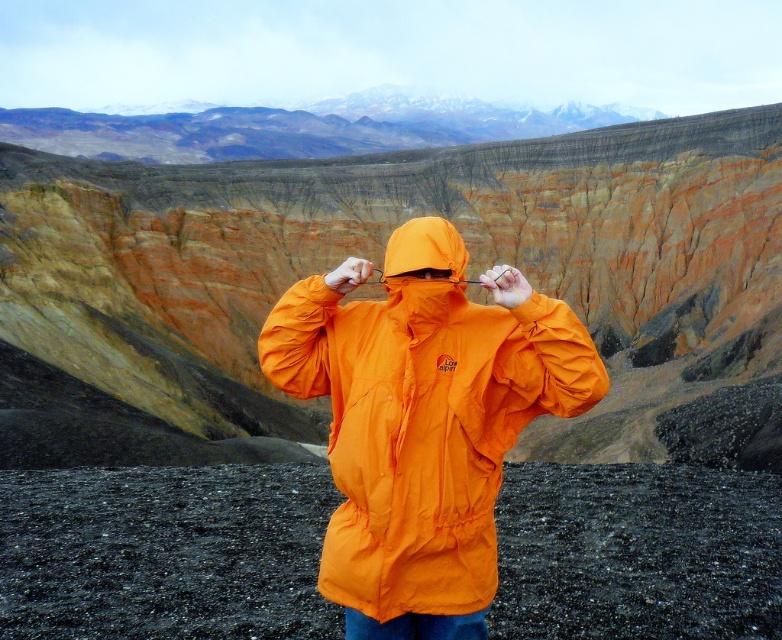
Measure the distance between orange fabric mountain at center and orange waterproof jacket at center.

They are 332.99 feet apart.

Does point (354, 298) come behind point (445, 433)?

Yes, point (354, 298) is farther from viewer.

Who is more distant from viewer, (623, 176) or (569, 413)?

The point (623, 176) is behind.

At what (x,y) coordinates should I click in order to perform the action: click on orange fabric mountain at center. Please return your answer as a coordinate pair (x, y). The image size is (782, 640). Looking at the image, I should click on (379, 262).